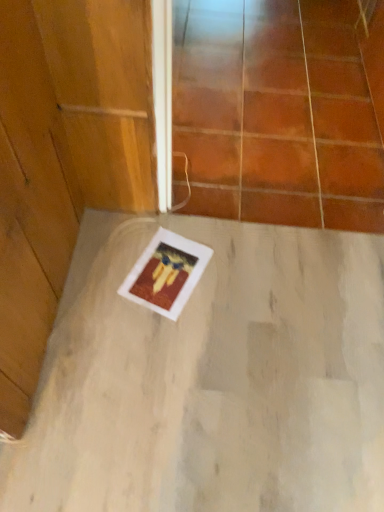
Find the location of a particular element. This screenshot has height=512, width=384. transparent glass door at upper center is located at coordinates (280, 111).

Describe the element at coordinates (280, 111) in the screenshot. I see `transparent glass door at upper center` at that location.

Find the location of a particular element. white matte concrete at center is located at coordinates (212, 379).

What is the approximate width of white matte concrete at center?

38.84 inches.

Measure the distance between point (343, 352) and camera.

Point (343, 352) is 4.19 feet from camera.

What do you see at coordinates (212, 379) in the screenshot? This screenshot has width=384, height=512. I see `white matte concrete at center` at bounding box center [212, 379].

You are a GUI agent. You are given a task and a screenshot of the screen. Output one action in this format:
    pyautogui.click(x=<x>, y=<y>)
    Task: Click on the transparent glass door at upper center
    Image resolution: width=384 pixels, height=512 pixels.
    Given the screenshot: What is the action you would take?
    pyautogui.click(x=280, y=111)

Which is more to the left, white matte concrete at center or transparent glass door at upper center?

white matte concrete at center is more to the left.

Is white matte concrete at center positioned in front of transparent glass door at upper center?

Yes, white matte concrete at center is closer to the camera.

Considering the positions of point (53, 431) and point (300, 125), is point (53, 431) closer or farther from the camera than point (300, 125)?

Point (53, 431) appears to be closer to the viewer than point (300, 125).

From the image's perspective, is white matte concrete at center above transparent glass door at upper center?

No.

From a real-world perspective, is white matte concrete at center located higher than transparent glass door at upper center?

No, from a real-world perspective, white matte concrete at center is not on top of transparent glass door at upper center.

Considering the sizes of objects white matte concrete at center and transparent glass door at upper center in the image provided, who is wider, white matte concrete at center or transparent glass door at upper center?

transparent glass door at upper center is wider.

Considering the sizes of white matte concrete at center and transparent glass door at upper center in the image, is white matte concrete at center taller or shorter than transparent glass door at upper center?

white matte concrete at center is taller than transparent glass door at upper center.

Can you confirm if white matte concrete at center is bigger than transparent glass door at upper center?

No, white matte concrete at center is not bigger than transparent glass door at upper center.

Would you say white matte concrete at center contains transparent glass door at upper center?

No, transparent glass door at upper center is not a part of white matte concrete at center.

From the picture: Are white matte concrete at center and transparent glass door at upper center far apart?

white matte concrete at center is near transparent glass door at upper center, not far away.

Is white matte concrete at center turned away from transparent glass door at upper center?

white matte concrete at center is not turned away from transparent glass door at upper center.

How different are the orientations of white matte concrete at center and transparent glass door at upper center in degrees?

There is a 180-degree angle between the facing directions of white matte concrete at center and transparent glass door at upper center.

Identify the location of concrete to the left of transparent glass door at upper center. (212, 379).

Considering the relative positions of transparent glass door at upper center and white matte concrete at center in the image provided, is transparent glass door at upper center to the left of white matte concrete at center from the viewer's perspective?

Incorrect, transparent glass door at upper center is not on the left side of white matte concrete at center.

Which object is more forward, transparent glass door at upper center or white matte concrete at center?

white matte concrete at center.

Consider the image. Which is closer, (x=377, y=59) or (x=356, y=435)?

The point (x=356, y=435) is closer.

From the image's perspective, is transparent glass door at upper center above white matte concrete at center?

Yes, from the image's perspective, transparent glass door at upper center is above white matte concrete at center.

From a real-world perspective, who is located higher, transparent glass door at upper center or white matte concrete at center?

transparent glass door at upper center, from a real-world perspective.

Is transparent glass door at upper center wider than white matte concrete at center?

Correct, the width of transparent glass door at upper center exceeds that of white matte concrete at center.

Based on the photo, who is taller, transparent glass door at upper center or white matte concrete at center?

With more height is white matte concrete at center.

Who is smaller, transparent glass door at upper center or white matte concrete at center?

Smaller between the two is white matte concrete at center.

Which is correct: transparent glass door at upper center is inside white matte concrete at center, or outside of it?

The correct answer is: outside.

Is transparent glass door at upper center placed right next to white matte concrete at center?

No, transparent glass door at upper center is not in contact with white matte concrete at center.

Is transparent glass door at upper center turned away from white matte concrete at center?

No, transparent glass door at upper center is not facing the opposite direction of white matte concrete at center.

How many degrees apart are the facing directions of transparent glass door at upper center and white matte concrete at center?

The angle between the facing direction of transparent glass door at upper center and the facing direction of white matte concrete at center is 180 degrees.

Where is `concrete that is in front of the transparent glass door at upper center`? concrete that is in front of the transparent glass door at upper center is located at coordinates (212, 379).

This screenshot has height=512, width=384. I want to click on glass door on the right of white matte concrete at center, so click(280, 111).

Find the location of a particular element. Image resolution: width=384 pixels, height=512 pixels. concrete below the transparent glass door at upper center (from a real-world perspective) is located at coordinates (212, 379).